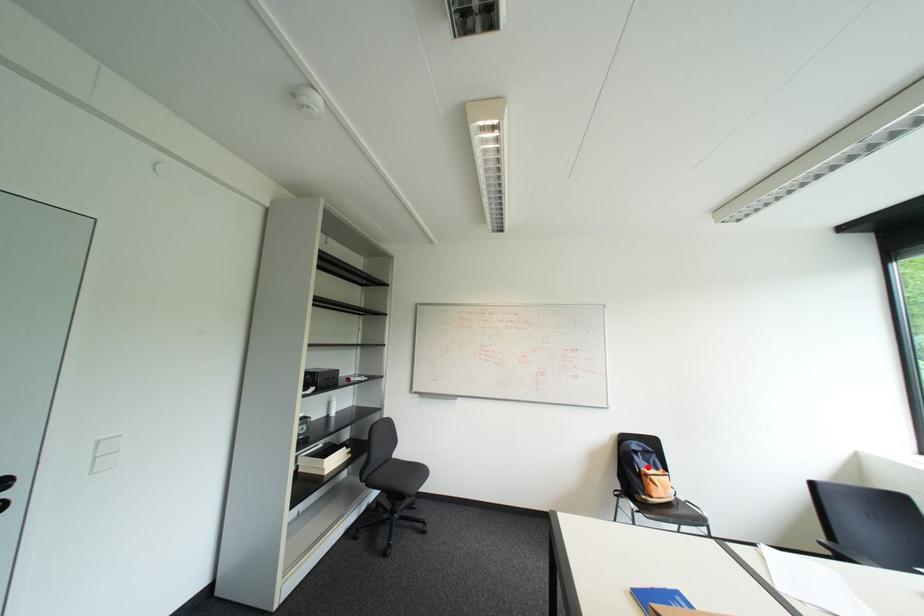
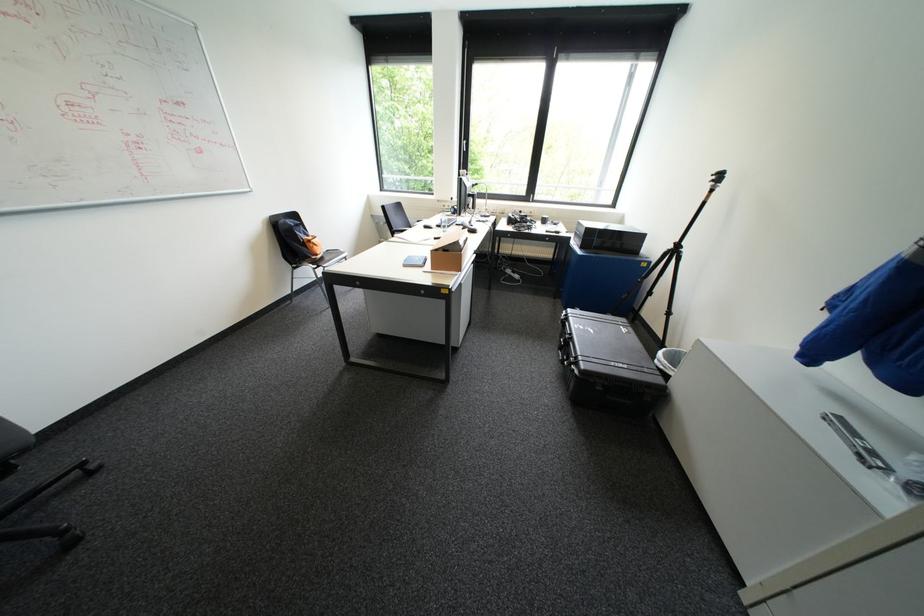
Where in the second image is the point corresponding to the highlighted location from the first image?

(310, 237)